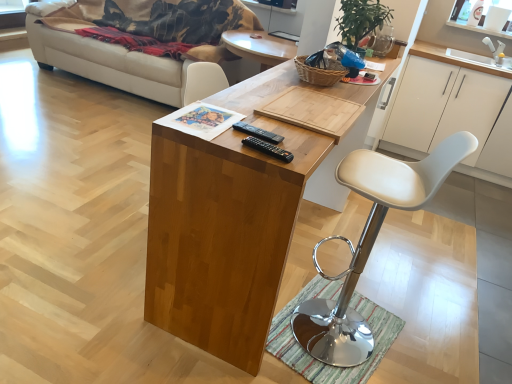
Identify the location of unoccupied region to the right of black plastic remote at center, arranged as the 2th remote when viewed from the front. (303, 142).